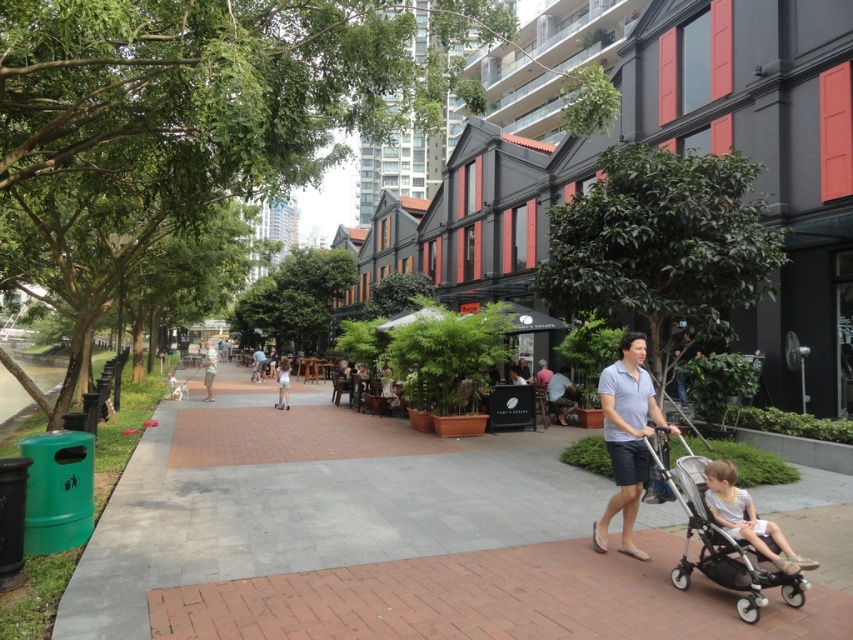
Can you confirm if brick pavement at center is taller than silver metallic stroller at lower right?

No.

Is brick pavement at center smaller than silver metallic stroller at lower right?

No, brick pavement at center is not smaller than silver metallic stroller at lower right.

Is point (527, 605) less distant than point (804, 582)?

No, (527, 605) is further to viewer.

You are a GUI agent. You are given a task and a screenshot of the screen. Output one action in this format:
    pyautogui.click(x=<x>, y=<y>)
    Task: Click on the brick pavement at center
    
    Given the screenshot: What is the action you would take?
    pyautogui.click(x=380, y=538)

Can you confirm if gray cotton shirt at center-right is bigger than light brown wooden pole at center?

Answer: No.

Can you confirm if gray cotton shirt at center-right is shorter than light brown wooden pole at center?

In fact, gray cotton shirt at center-right may be taller than light brown wooden pole at center.

Measure the distance between point [611,397] and camera.

A distance of 16.74 feet exists between point [611,397] and camera.

What are the coordinates of `gray cotton shirt at center-right` in the screenshot? It's located at (625, 436).

Which is above, brick pavement at center or gray cotton shirt at center-right?

Positioned higher is gray cotton shirt at center-right.

Looking at this image, is brick pavement at center taller than gray cotton shirt at center-right?

No.

This screenshot has width=853, height=640. What do you see at coordinates (380, 538) in the screenshot? I see `brick pavement at center` at bounding box center [380, 538].

You are a GUI agent. You are given a task and a screenshot of the screen. Output one action in this format:
    pyautogui.click(x=<x>, y=<y>)
    Task: Click on the brick pavement at center
    
    Given the screenshot: What is the action you would take?
    pyautogui.click(x=380, y=538)